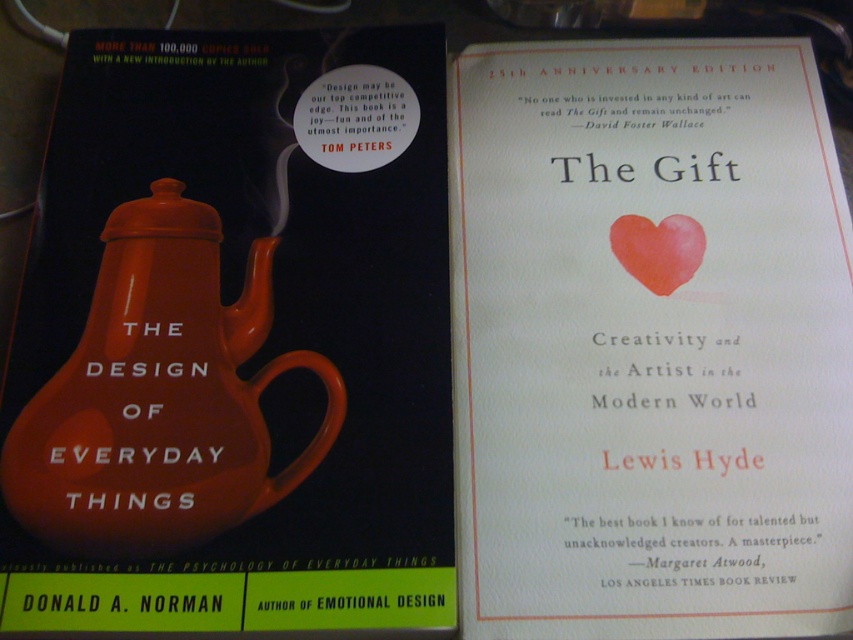
Question: Is matte ceramic teapot at left behind watercolor paper heart at center?

Choices:
 (A) yes
 (B) no

Answer: (B)

Question: Which point appears farthest from the camera in this image?

Choices:
 (A) (621, 248)
 (B) (366, 436)
 (C) (618, 557)
 (D) (61, 481)

Answer: (A)

Question: Which point is farther to the camera?

Choices:
 (A) matte ceramic teapot at left
 (B) watercolor paper heart at center
 (C) matte paper cover at center
 (D) matte ceramic teapot at center

Answer: (B)

Question: Does matte paper cover at center come behind matte ceramic teapot at left?

Choices:
 (A) yes
 (B) no

Answer: (B)

Question: Which is farther from the matte ceramic teapot at center?

Choices:
 (A) watercolor paper heart at center
 (B) matte ceramic teapot at left

Answer: (A)

Question: Does matte ceramic teapot at left appear on the left side of watercolor paper heart at center?

Choices:
 (A) yes
 (B) no

Answer: (A)